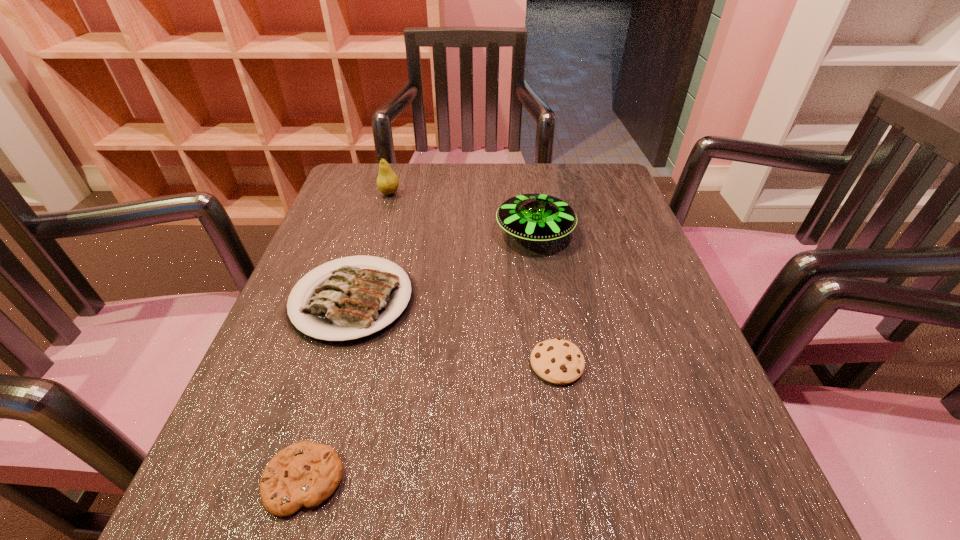
I want to click on the tallest object, so click(x=387, y=182).

Where is `pear`? The image size is (960, 540). pear is located at coordinates (387, 182).

Locate an element on the screen. The height and width of the screenshot is (540, 960). the fourth shortest object is located at coordinates (534, 217).

Locate an element on the screen. plate is located at coordinates (353, 302).

Find the location of a particular element. The image size is (960, 540). the right cookie is located at coordinates (557, 361).

The width and height of the screenshot is (960, 540). Find the location of `the nearest object`. the nearest object is located at coordinates (306, 473).

Find the location of a particular element. This screenshot has width=960, height=540. the nearer cookie is located at coordinates (306, 473).

Where is `vacant space located on the left of the pear`? The height and width of the screenshot is (540, 960). vacant space located on the left of the pear is located at coordinates (344, 193).

At what (x,y) coordinates should I click in order to perform the action: click on free spot located on the left of the second tallest object. Please return your answer as a coordinate pair (x, y). The image size is (960, 540). Looking at the image, I should click on (408, 233).

Identify the location of vacant space situated on the right of the plate. This screenshot has width=960, height=540. (514, 300).